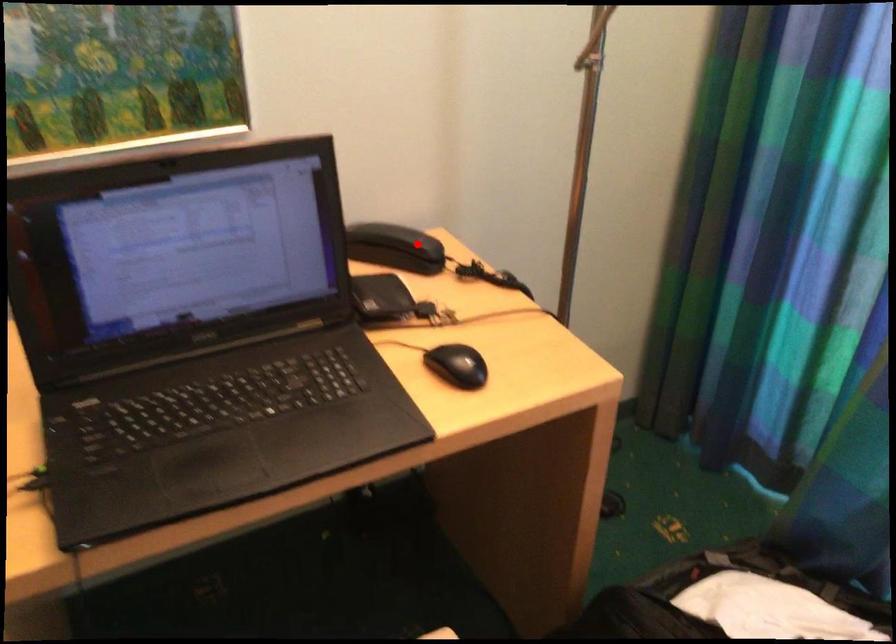
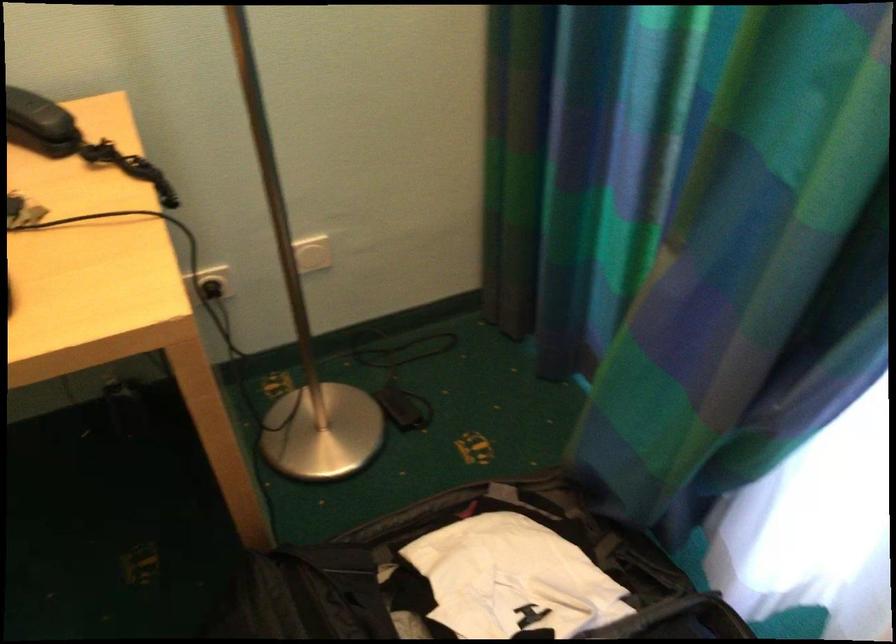
Find the pixel in the second image that matches the highlighted location in the first image.

(40, 122)